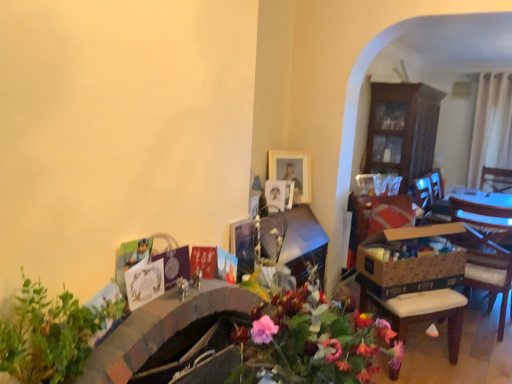
Question: Is green leafy plant at lower left beside brown cardboard box at right?

Choices:
 (A) no
 (B) yes

Answer: (A)

Question: Is green leafy plant at lower left shorter than brown cardboard box at right?

Choices:
 (A) no
 (B) yes

Answer: (A)

Question: Is green leafy plant at lower left far away from brown cardboard box at right?

Choices:
 (A) no
 (B) yes

Answer: (B)

Question: From a real-world perspective, is green leafy plant at lower left over brown cardboard box at right?

Choices:
 (A) no
 (B) yes

Answer: (B)

Question: Can you confirm if green leafy plant at lower left is positioned to the right of brown cardboard box at right?

Choices:
 (A) yes
 (B) no

Answer: (B)

Question: Is the depth of green leafy plant at lower left less than that of brown cardboard box at right?

Choices:
 (A) yes
 (B) no

Answer: (A)

Question: From the image's perspective, is green leafy plant at lower left below wooden cabinet at right?

Choices:
 (A) no
 (B) yes

Answer: (B)

Question: Is green leafy plant at lower left not near wooden cabinet at right?

Choices:
 (A) yes
 (B) no

Answer: (A)

Question: Does green leafy plant at lower left come in front of wooden cabinet at right?

Choices:
 (A) no
 (B) yes

Answer: (B)

Question: Is green leafy plant at lower left bigger than wooden cabinet at right?

Choices:
 (A) no
 (B) yes

Answer: (A)

Question: Is wooden cabinet at right a part of green leafy plant at lower left?

Choices:
 (A) yes
 (B) no

Answer: (B)

Question: Is green leafy plant at lower left placed right next to wooden cabinet at right?

Choices:
 (A) yes
 (B) no

Answer: (B)

Question: Can you see wooden chair at right touching wooden cabinet at right?

Choices:
 (A) no
 (B) yes

Answer: (A)